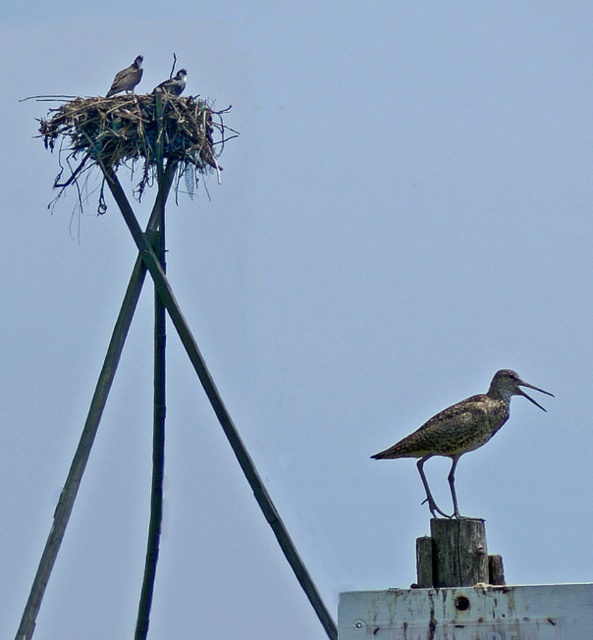
Question: Can you confirm if speckled feathered bird at center is positioned below dark gray feathers at upper left?

Choices:
 (A) yes
 (B) no

Answer: (A)

Question: Which object is farther from the camera taking this photo?

Choices:
 (A) brown speckled bird at upper left
 (B) dark gray feathers at upper left

Answer: (A)

Question: Among these objects, which one is farthest from the camera?

Choices:
 (A) brown speckled bird at upper left
 (B) speckled feathered bird at center
 (C) dark gray feathers at upper left

Answer: (A)

Question: Does speckled feathered bird at center have a greater width compared to brown speckled bird at upper left?

Choices:
 (A) yes
 (B) no

Answer: (A)

Question: From the image, what is the correct spatial relationship of speckled feathered bird at center in relation to dark gray feathers at upper left?

Choices:
 (A) right
 (B) left

Answer: (A)

Question: Estimate the real-world distances between objects in this image. Which object is farther from the brown speckled bird at upper left?

Choices:
 (A) dark gray feathers at upper left
 (B) speckled feathered bird at center

Answer: (B)